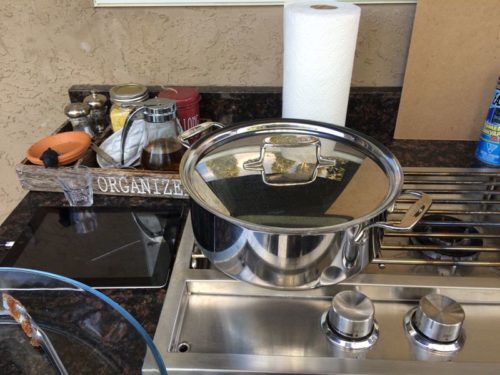
Point out all instances of where you'd turn on stove in the image. Your answer should be formatted as a list of tuples, i.e. [(x1, y1), (x2, y2), ...], where each tuple contains the x and y coordinates of a point satisfying the conditions above.

[(351, 314), (441, 320)]